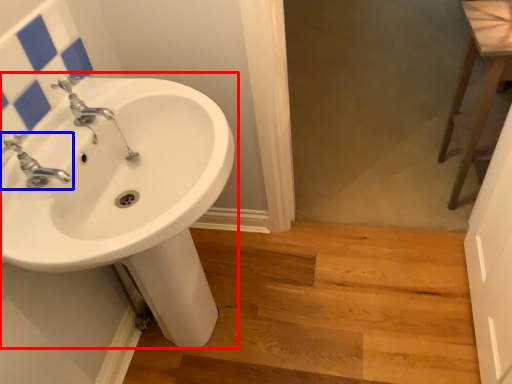
Question: Which point is further to the camera, sink (highlighted by a red box) or tap (highlighted by a blue box)?

Choices:
 (A) sink
 (B) tap

Answer: (B)